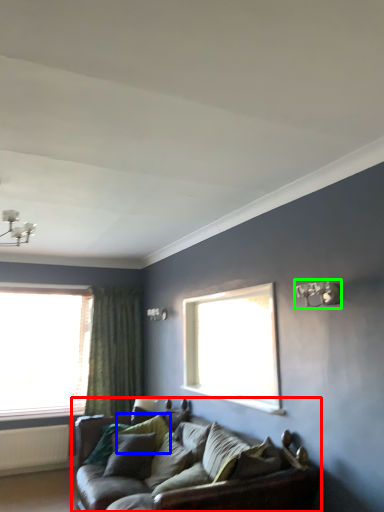
Question: Which object is the closest to the studio couch (highlighted by a red box)? Choose among these: pillow (highlighted by a blue box) or light fixture (highlighted by a green box).

Choices:
 (A) pillow
 (B) light fixture

Answer: (A)